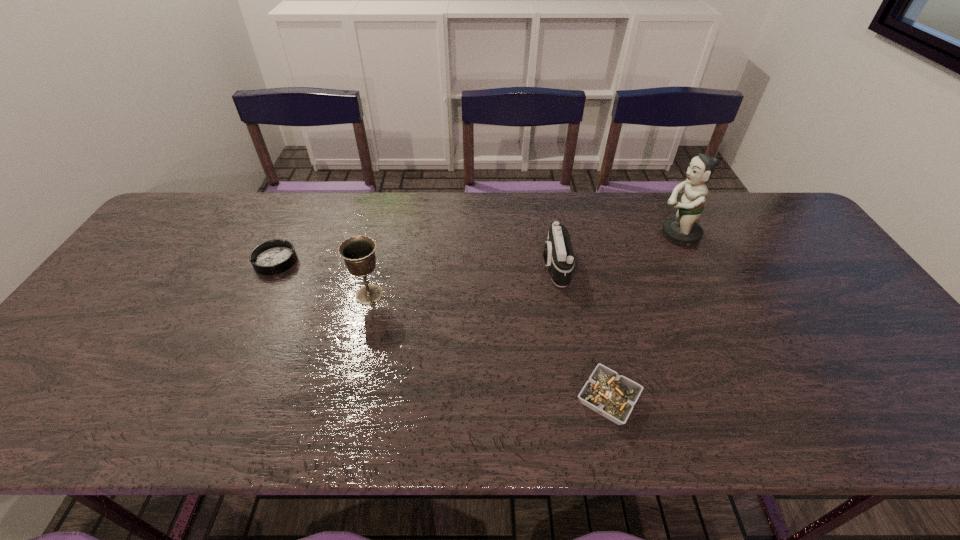
Find the location of a particular element. The height and width of the screenshot is (540, 960). the tallest object is located at coordinates (683, 230).

Locate an element on the screen. Image resolution: width=960 pixels, height=540 pixels. figurine is located at coordinates coord(683,230).

Find the location of a particular element. The image size is (960, 540). the second object from left to right is located at coordinates (358, 252).

Locate an element on the screen. This screenshot has height=540, width=960. chalice is located at coordinates [x=358, y=252].

Locate an element on the screen. the third shortest object is located at coordinates (558, 254).

The image size is (960, 540). Find the location of `the left ashtray`. the left ashtray is located at coordinates (271, 257).

Identify the location of the leftmost object. (271, 257).

The image size is (960, 540). Identify the location of the nearest object. (613, 396).

This screenshot has height=540, width=960. Identify the location of the nearer ashtray. (613, 396).

Identify the location of free region located on the front-facing side of the tallest object. (552, 235).